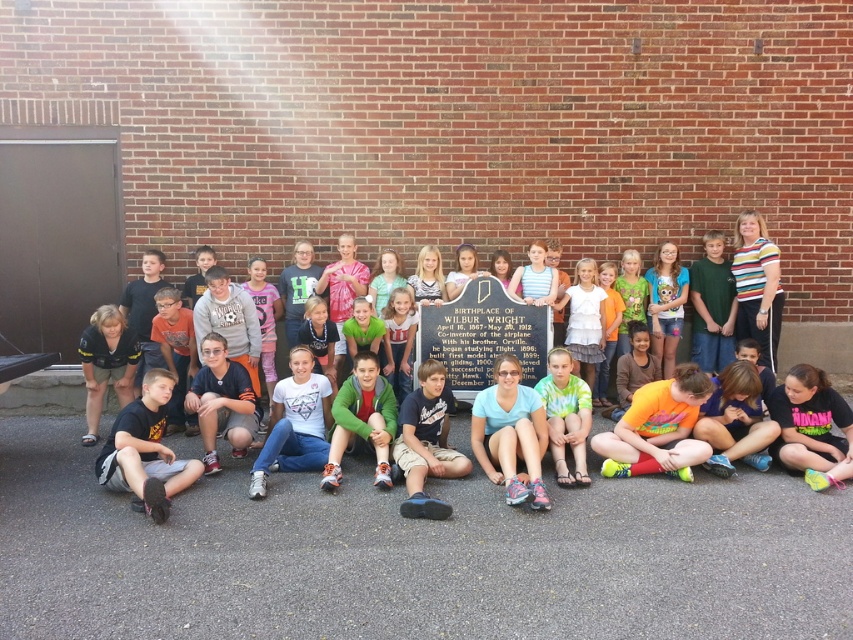
You are standing in front of the plaque at the Birthplace of Wilbur Wright. You notice two points marked in the image. The first point is at coordinate (572,392) and the second at (281,339). Which point is closer to you?

Point (572,392) is closer to you than point (281,339).

In the scene shown: You are standing at the point marked as point (583,388) and want to take a photo of the plaque. The camera you have is 6 meters away from you. Is the camera within your reach to take the photo?

The distance between point (583,388) and the camera is 6.43 meters, which is slightly longer than the 6 meters your camera can reach. Therefore, you need to move closer to the plaque to take the photo.